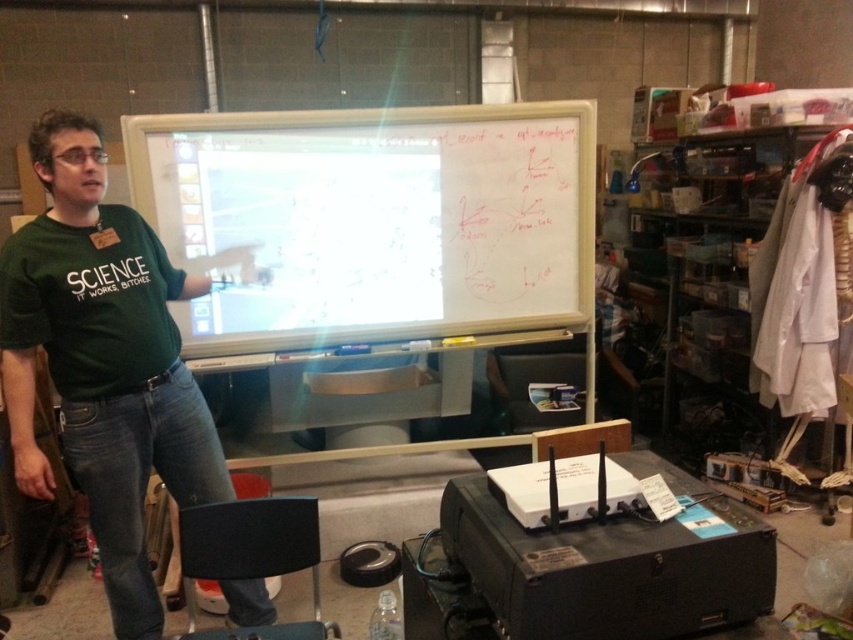
You are an attendee at the presentation and want to take a photo of the whiteboard at center. However, the green fabric shirt at left is blocking your view. Can you move around to the right side of the presenter to get a clear shot?

The whiteboard at center is positioned over the green fabric shirt at left, meaning the shirt is in front of the whiteboard from your current angle. Moving to the right side of the presenter would likely provide a clearer view as the shirt would no longer obstruct the whiteboard.

You are an attendee at this presentation and need to take a photo of the whiteboard at center and the green matte shirt at center for your notes. Which object should you focus on first if you want to capture both in one frame without zooming in or out?

The whiteboard at center is smaller than the green matte shirt at center, so you should focus on the whiteboard at center first to ensure it is in frame before the larger green matte shirt at center blocks it.